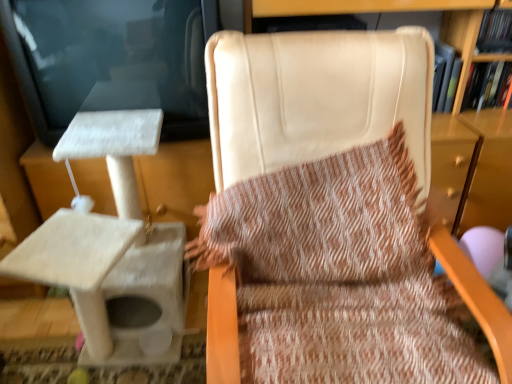
Question: Is hardcover book at upper right inside or outside of beige leather chair at center?

Choices:
 (A) inside
 (B) outside

Answer: (B)

Question: Looking at the image, does hardcover book at upper right seem bigger or smaller compared to beige leather chair at center?

Choices:
 (A) small
 (B) big

Answer: (A)

Question: Estimate the real-world distances between objects in this image. Which object is farther from the hardcover book at upper right?

Choices:
 (A) beige leather chair at center
 (B) white textured cat tree at left

Answer: (B)

Question: Estimate the real-world distances between objects in this image. Which object is farther from the hardcover book at upper right?

Choices:
 (A) beige leather chair at center
 (B) white textured cat tree at left

Answer: (B)